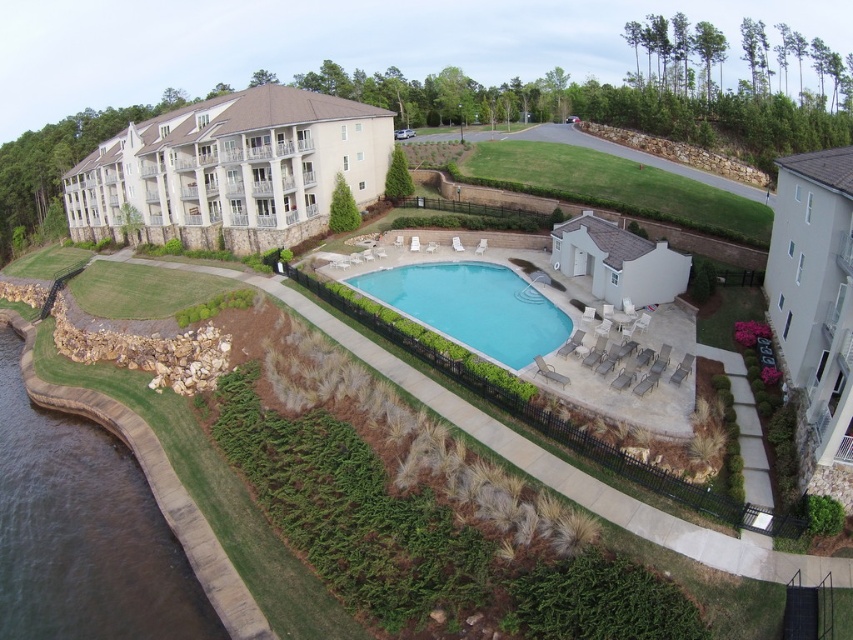
Who is positioned more to the left, dark brown concrete waterway at lower left or clear blue water at center?

dark brown concrete waterway at lower left

Is dark brown concrete waterway at lower left bigger than clear blue water at center?

Correct, dark brown concrete waterway at lower left is larger in size than clear blue water at center.

Identify the location of dark brown concrete waterway at lower left. This screenshot has height=640, width=853. (83, 532).